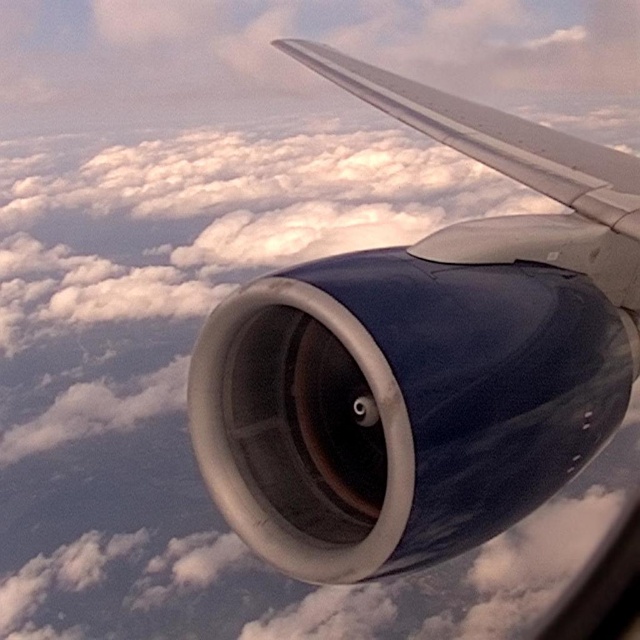
Question: Can you confirm if matte blue engine at center is thinner than metallic silver wing at upper right?

Choices:
 (A) no
 (B) yes

Answer: (B)

Question: Does matte blue engine at center have a greater width compared to metallic silver wing at upper right?

Choices:
 (A) yes
 (B) no

Answer: (B)

Question: Among these objects, which one is farthest from the camera?

Choices:
 (A) matte blue engine at center
 (B) metallic silver wing at upper right

Answer: (B)

Question: Can you confirm if matte blue engine at center is positioned below metallic silver wing at upper right?

Choices:
 (A) yes
 (B) no

Answer: (A)

Question: Which point is closer to the camera?

Choices:
 (A) matte blue engine at center
 (B) metallic silver wing at upper right

Answer: (A)